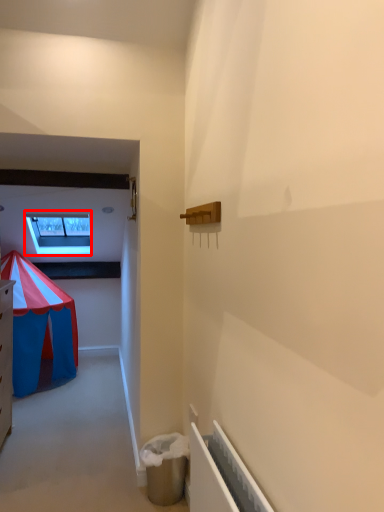
Question: Considering the relative positions of window (annotated by the red box) and radiator in the image provided, where is window (annotated by the red box) located with respect to the staircase?

Choices:
 (A) left
 (B) right

Answer: (A)